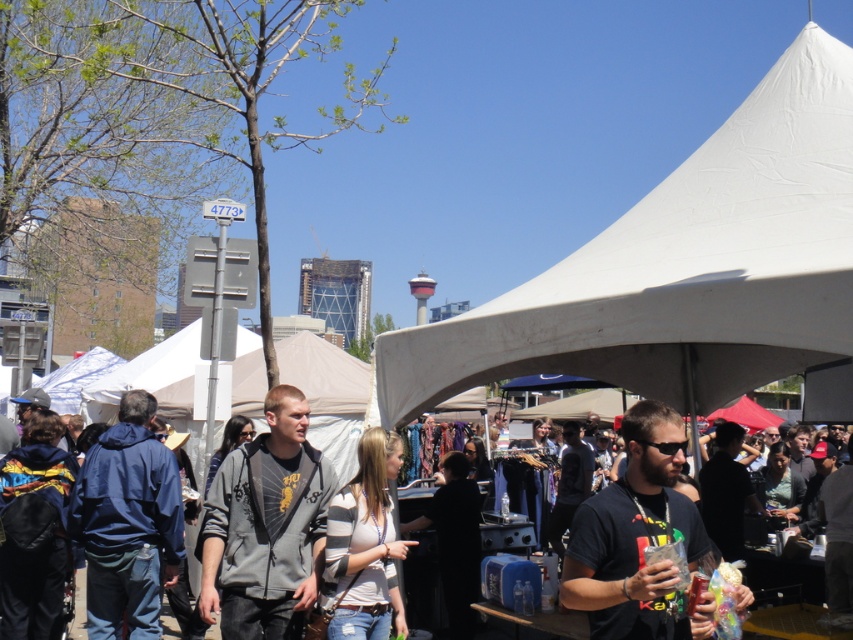
Question: Is gray fleece jacket at center smaller than dark gray hoodie at center?

Choices:
 (A) no
 (B) yes

Answer: (A)

Question: Which of the following is the closest to the observer?

Choices:
 (A) black matte t-shirt at center
 (B) navy blue jacket at left
 (C) striped cotton shirt at center
 (D) dark gray hoodie at center

Answer: (A)

Question: Observing the image, what is the correct spatial positioning of black matte t-shirt at center in reference to dark gray hoodie at center?

Choices:
 (A) left
 (B) right

Answer: (B)

Question: Which of the following is the closest to the observer?

Choices:
 (A) (318, 525)
 (B) (291, 440)
 (C) (364, 630)
 (D) (814, 346)

Answer: (D)

Question: Does white fabric canopy at upper center come in front of black matte t-shirt at center?

Choices:
 (A) yes
 (B) no

Answer: (B)

Question: Based on their relative distances, which object is farther from the black matte t-shirt at center?

Choices:
 (A) navy blue jacket at left
 (B) white fabric canopy at upper center
 (C) gray fleece jacket at center

Answer: (A)